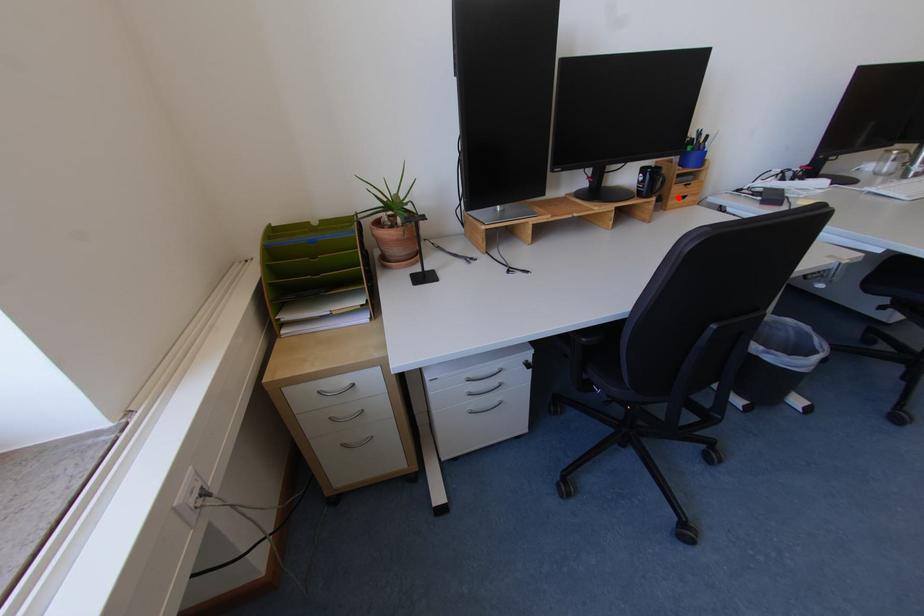
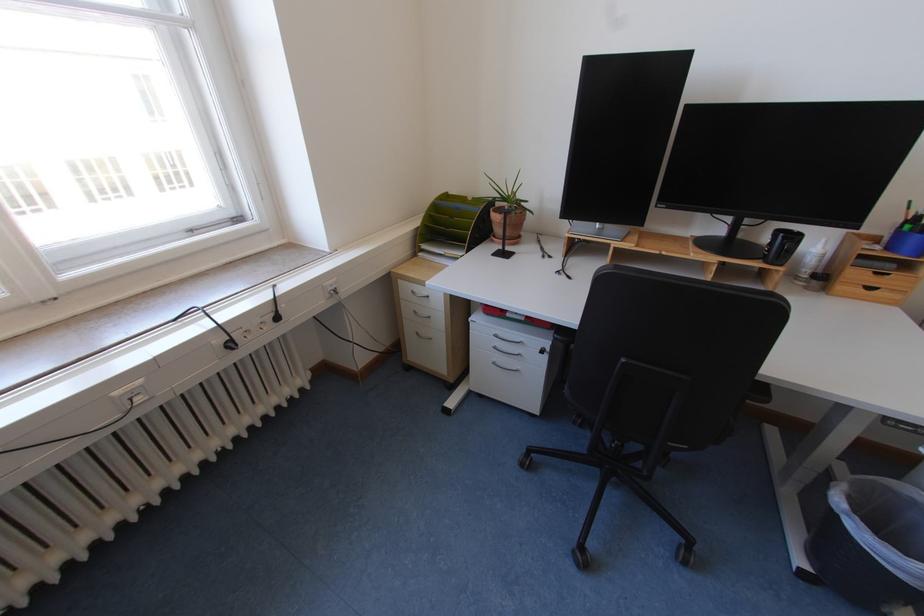
Where in the second image is the point corresponding to the highlighted location from the first image?

(848, 281)